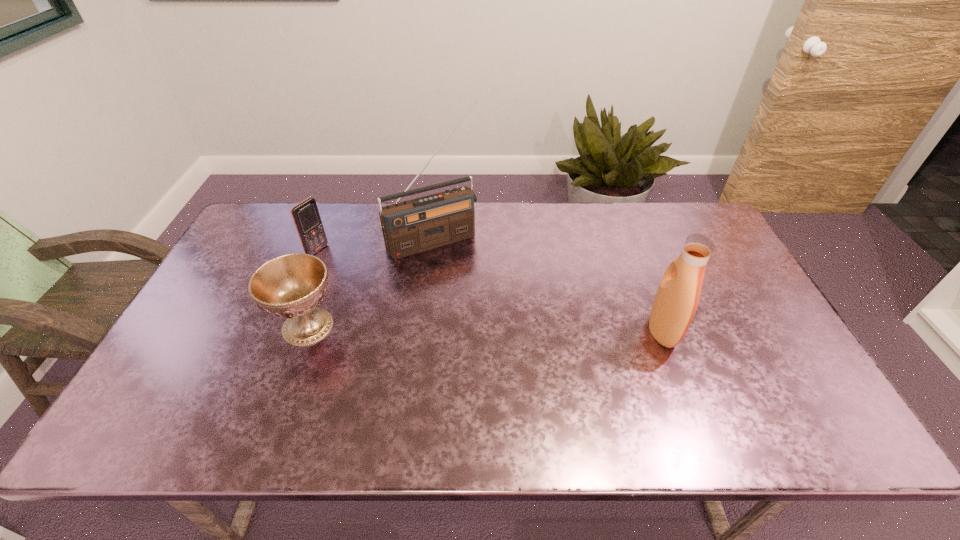
What are the coordinates of `vacant region located 0.360m on the front-facing side of the radio receiver` in the screenshot? It's located at (502, 340).

Where is `free point located on the screen of the cellular telephone`? free point located on the screen of the cellular telephone is located at coordinates (372, 280).

This screenshot has width=960, height=540. I want to click on vacant point located on the screen of the cellular telephone, so (346, 266).

Where is `blank space located 0.260m on the screen of the cellular telephone`? The width and height of the screenshot is (960, 540). blank space located 0.260m on the screen of the cellular telephone is located at coordinates (385, 286).

Identify the location of radio receiver at the far edge. (x=409, y=227).

Identify the location of cellular telephone positioned at the far edge. (306, 216).

The height and width of the screenshot is (540, 960). In the image, there is a desktop. Identify the location of blank space at the far edge. (630, 212).

You are a GUI agent. You are given a task and a screenshot of the screen. Output one action in this format:
    pyautogui.click(x=<x>, y=<y>)
    Task: Click on the vacant space at the near edge
    Image resolution: width=960 pixels, height=540 pixels.
    Given the screenshot: What is the action you would take?
    611,395

The height and width of the screenshot is (540, 960). Identify the location of vacant region at the left edge. (222, 301).

Find the location of a particular element. free spot at the right edge of the desktop is located at coordinates (742, 363).